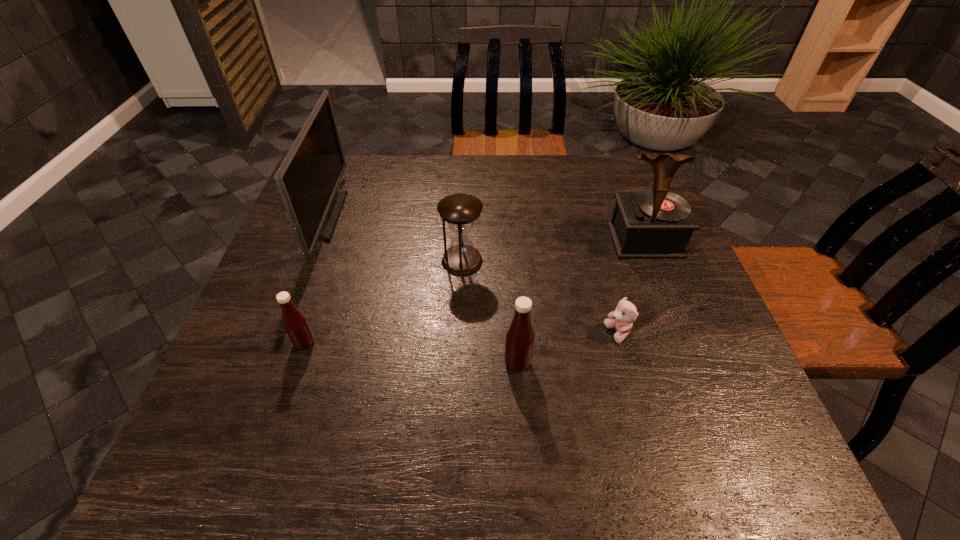
You are a GUI agent. You are given a task and a screenshot of the screen. Output one action in this format:
    pyautogui.click(x=<x>, y=<y>)
    Task: Click on the vacant region located 0.210m on the left of the taller Tabasco sauce
    This screenshot has width=960, height=540.
    Given the screenshot: What is the action you would take?
    pyautogui.click(x=399, y=363)

The image size is (960, 540). Find the location of `free space located on the left of the fourth object from right to left`. free space located on the left of the fourth object from right to left is located at coordinates (393, 261).

What are the coordinates of `vacant space located on the screen side of the monitor` in the screenshot? It's located at (416, 217).

Identify the location of free point located 0.110m at the horn opening of the phonograph_record. (665, 293).

Image resolution: width=960 pixels, height=540 pixels. Identify the location of vacant space located 0.150m at the face of the teddy bear. (534, 334).

Locate an element on the screen. This screenshot has height=540, width=960. vacant region located 0.120m at the face of the teddy bear is located at coordinates (548, 334).

This screenshot has height=540, width=960. I want to click on free spot located at the face of the teddy bear, so click(563, 334).

In order to click on object present at the far edge in this screenshot , I will do `click(308, 178)`.

Identify the location of Tabasco sauce located in the left edge section of the desktop. tap(294, 322).

Find the location of a particular element. monitor situated at the left edge is located at coordinates coord(308,178).